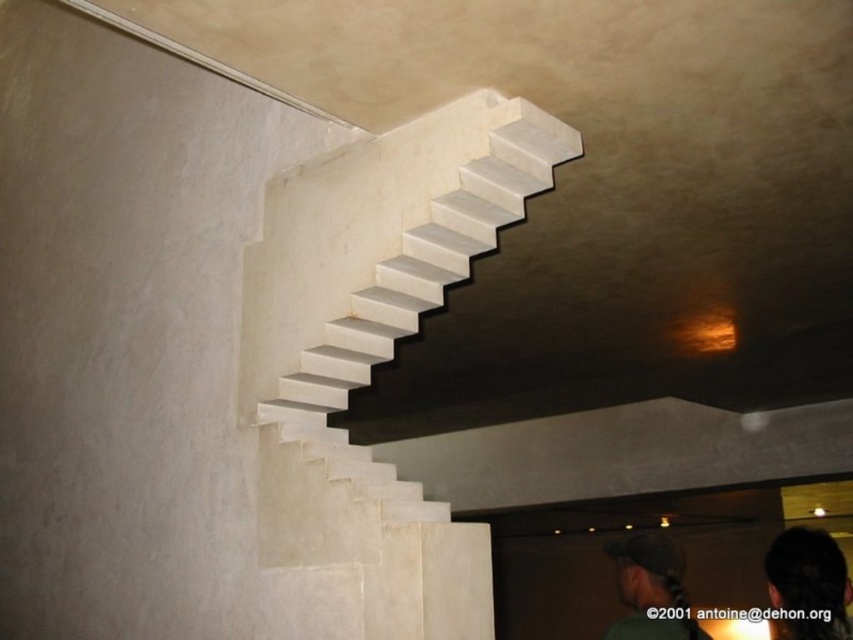
You are an interior designer planning to install a new light fixture. You notice the white marble stairs at upper center and the dark green fabric cap at upper center. Which object is larger in size?

The dark green fabric cap at upper center is larger than the white marble stairs at upper center.

You are a painter standing at the bottom of the white marble stairs at upper center and want to paint the dark hair at lower right. Which object is higher in the image?

The white marble stairs at upper center are higher than the dark hair at lower right, so the stairs are higher.

You are standing at the bottom of the white marble stairs at upper center and want to move to the dark hair at lower right. Which direction should you go?

You should move downward because the white marble stairs at upper center is positioned over the dark hair at lower right, so going downward will lead you towards the dark hair at lower right.